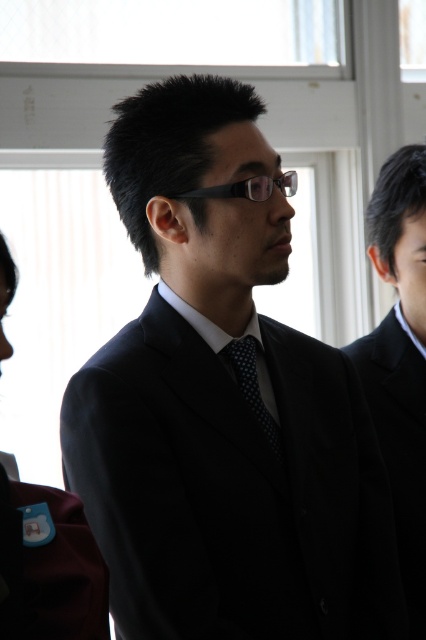
Is point (287, 221) positioned before point (388, 406)?

That is True.

Is matte black suit at center wider than black matte suit at right?

Correct, the width of matte black suit at center exceeds that of black matte suit at right.

Is point (175, 472) in front of point (383, 250)?

Yes.

Image resolution: width=426 pixels, height=640 pixels. I want to click on matte black suit at center, so click(222, 403).

Does maroon fabric uniform at left appear on the right side of polka dot silk tie at center?

In fact, maroon fabric uniform at left is to the left of polka dot silk tie at center.

Which of these two, maroon fabric uniform at left or polka dot silk tie at center, stands taller?

With more height is maroon fabric uniform at left.

Is point (57, 580) farther from viewer compared to point (235, 372)?

No, (57, 580) is in front of (235, 372).

The width and height of the screenshot is (426, 640). What are the coordinates of `maroon fabric uniform at left` in the screenshot? It's located at (48, 566).

Is black matte suit at right smaller than polka dot silk tie at center?

Incorrect, black matte suit at right is not smaller in size than polka dot silk tie at center.

Does black matte suit at right appear over polka dot silk tie at center?

Yes, black matte suit at right is above polka dot silk tie at center.

Does point (411, 182) lie in front of point (253, 404)?

No, (411, 182) is further to viewer.

Find the location of `black matte suit at right`. black matte suit at right is located at coordinates (400, 358).